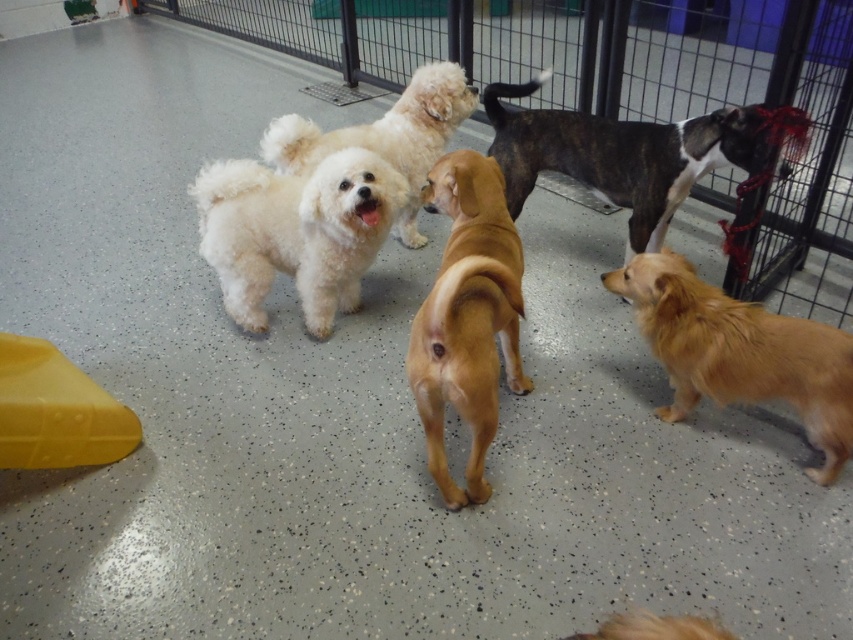
You are standing in the indoor play area and want to move towards the point where the white fluffy dog at center is located. The coordinates of this point are given as point (294, 230). If you start from the entrance located at the bottom left corner of the play area, in which general direction should you move to reach the white fluffy dog at center?

To reach the white fluffy dog at center located at point (294, 230) from the entrance at the bottom left corner, you should move towards the upper right direction since the coordinates indicate a position that is to the right and above the starting point.

You are standing in the indoor play area and see two points marked on the floor. The first point is at coordinate point [225,221] and the second is at point [445,122]. Which point is closer to you?

Point [225,221] is in front of point [445,122], so it is closer to you.

In the scene, there are two dogs labeled as the white fluffy dog at center and the fluffy white dog at center. Which one is positioned lower in the image?

The white fluffy dog at center is positioned lower than the fluffy white dog at center according to the description.